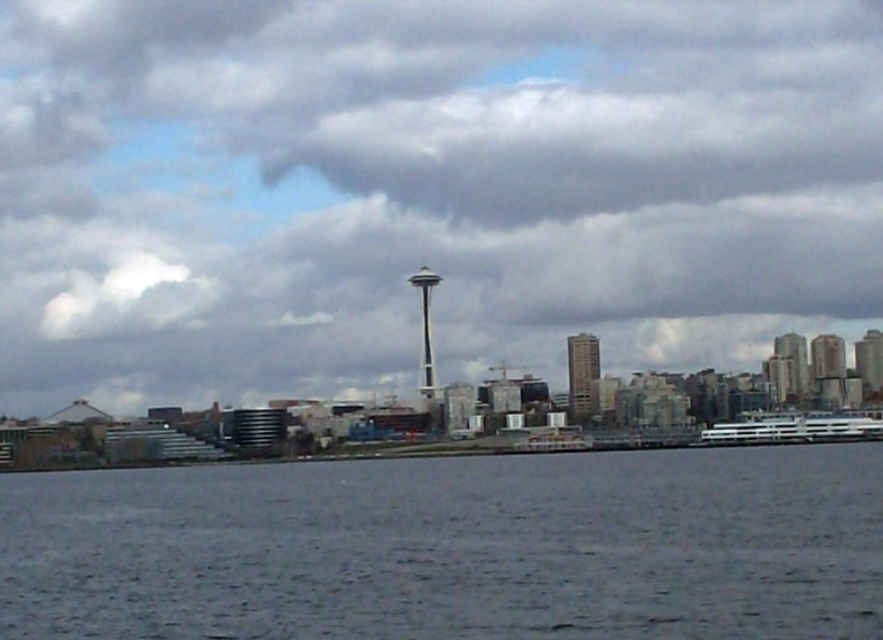
Question: Which point is closer to the camera taking this photo?

Choices:
 (A) (109, 288)
 (B) (465, 618)
 (C) (812, 413)

Answer: (B)

Question: Which object appears closest to the camera in this image?

Choices:
 (A) cloudy sky at center
 (B) white glossy ferry at right

Answer: (A)

Question: Which is nearer to the cloudy sky at center?

Choices:
 (A) gray matte water at lower center
 (B) white glossy ferry at right

Answer: (A)

Question: Does cloudy sky at center have a lesser width compared to white glossy ferry at right?

Choices:
 (A) yes
 (B) no

Answer: (B)

Question: Can you confirm if cloudy sky at center is wider than gray matte water at lower center?

Choices:
 (A) yes
 (B) no

Answer: (A)

Question: Is cloudy sky at center below gray matte water at lower center?

Choices:
 (A) no
 (B) yes

Answer: (A)